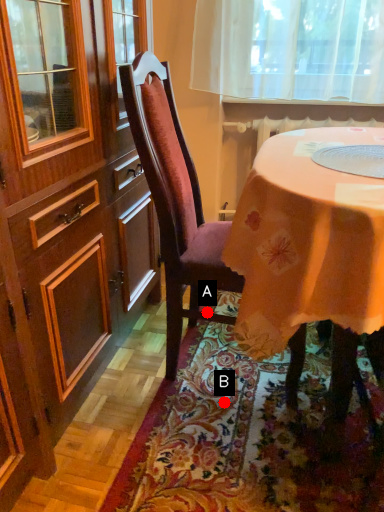
Question: Two points are circled on the image, labeled by A and B beside each circle. Which point is closer to the camera?

Choices:
 (A) A is closer
 (B) B is closer

Answer: (B)